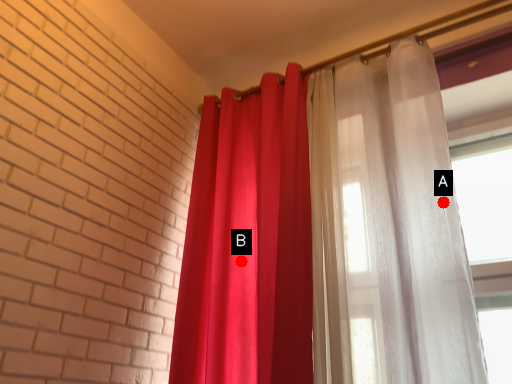
Question: Two points are circled on the image, labeled by A and B beside each circle. Which point appears farthest from the camera in this image?

Choices:
 (A) A is further
 (B) B is further

Answer: (B)